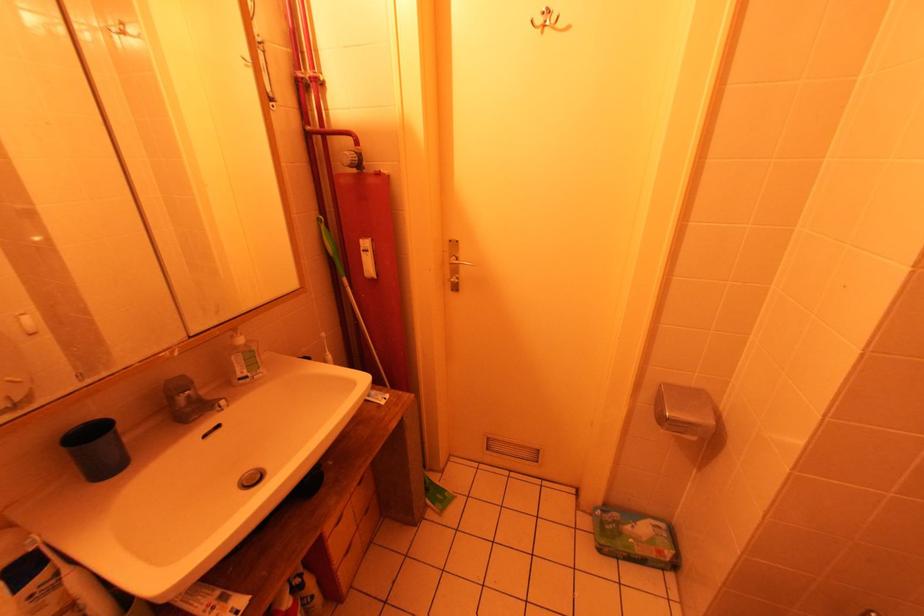
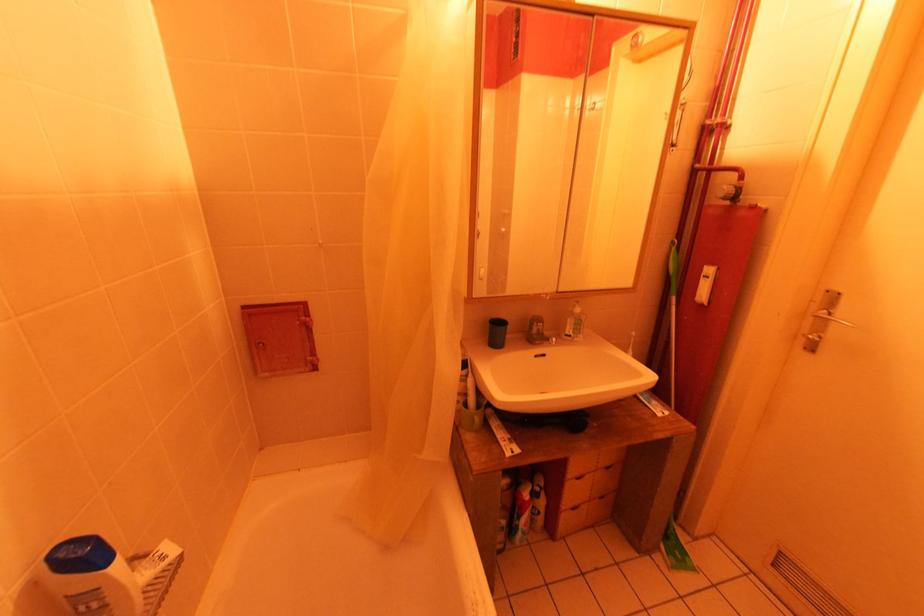
Question: The camera is either moving clockwise (left) or counter-clockwise (right) around the object. The first image is from the beginning of the video and the second image is from the end. Is the camera moving left or right when shooting the video?

Choices:
 (A) Left
 (B) Right

Answer: (B)